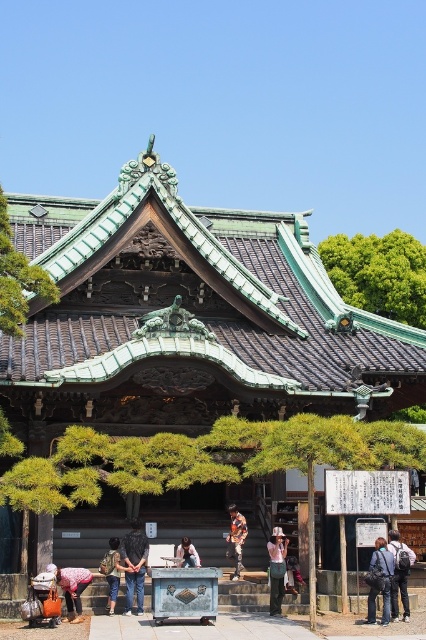
You are a visitor at the temple and want to place your wooden hat at center onto your matte brown pants at lower left. Given that you can only move in a straight line, will you be able to do so without any obstacles?

The matte brown pants at lower left and wooden hat at center are 8.74 meters apart. Since there are no mentioned obstacles in the scene description, you can move in a straight line to place the wooden hat at center onto the matte brown pants at lower left.

You are a visitor at this traditional Japanese temple and notice both the green leafy tree at upper left and the wooden hat at center. Which object would cast a bigger shadow on the ground?

The green leafy tree at upper left is larger in size than the wooden hat at center, so it would cast a bigger shadow on the ground.